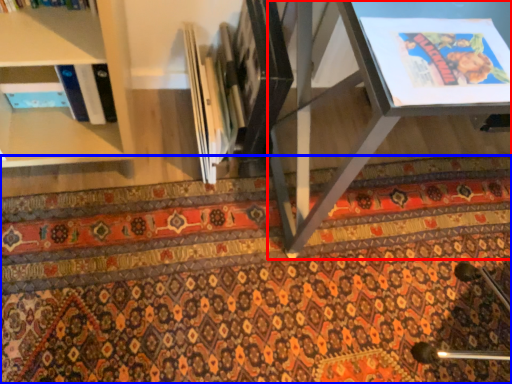
Question: Among these objects, which one is farthest to the camera, table (highlighted by a red box) or mat (highlighted by a blue box)?

Choices:
 (A) table
 (B) mat

Answer: (B)